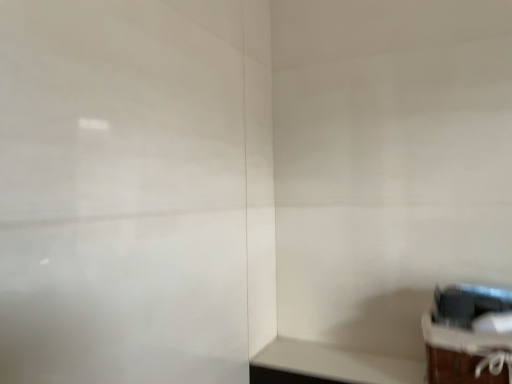
Question: Is wooden crate at lower right bigger than white matte table at lower right?

Choices:
 (A) yes
 (B) no

Answer: (A)

Question: Can you confirm if wooden crate at lower right is positioned to the left of white matte table at lower right?

Choices:
 (A) yes
 (B) no

Answer: (B)

Question: From the image's perspective, is wooden crate at lower right under white matte table at lower right?

Choices:
 (A) no
 (B) yes

Answer: (A)

Question: Is white matte table at lower right located within wooden crate at lower right?

Choices:
 (A) yes
 (B) no

Answer: (B)

Question: Is wooden crate at lower right taller than white matte table at lower right?

Choices:
 (A) yes
 (B) no

Answer: (A)

Question: Is the depth of wooden crate at lower right less than that of white matte table at lower right?

Choices:
 (A) yes
 (B) no

Answer: (A)

Question: From a real-world perspective, does white matte table at lower right stand above wooden crate at lower right?

Choices:
 (A) no
 (B) yes

Answer: (A)

Question: Does white matte table at lower right turn towards wooden crate at lower right?

Choices:
 (A) no
 (B) yes

Answer: (A)

Question: Does white matte table at lower right have a larger size compared to wooden crate at lower right?

Choices:
 (A) no
 (B) yes

Answer: (A)

Question: Is white matte table at lower right next to wooden crate at lower right and touching it?

Choices:
 (A) no
 (B) yes

Answer: (A)

Question: Does white matte table at lower right have a greater height compared to wooden crate at lower right?

Choices:
 (A) yes
 (B) no

Answer: (B)

Question: From a real-world perspective, is white matte table at lower right located beneath wooden crate at lower right?

Choices:
 (A) yes
 (B) no

Answer: (A)

Question: Is point (476, 354) positioned closer to the camera than point (297, 367)?

Choices:
 (A) closer
 (B) farther

Answer: (A)